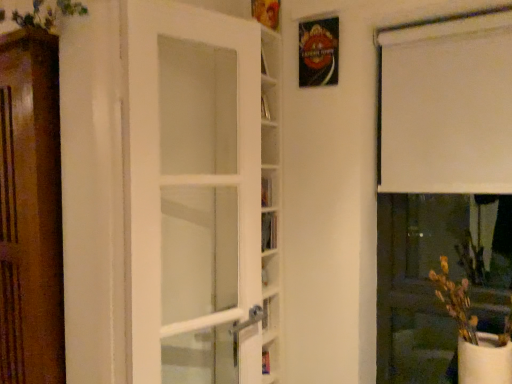
Question: From a real-world perspective, is white glass door at center positioned above or below hardcover book at center?

Choices:
 (A) below
 (B) above

Answer: (A)

Question: Is point (186, 14) positioned closer to the camera than point (270, 203)?

Choices:
 (A) closer
 (B) farther

Answer: (A)

Question: Based on their relative distances, which object is nearer to the white glass door at center?

Choices:
 (A) green leafy plant at upper left
 (B) white matte vase at lower right
 (C) metallic poster at upper center
 (D) hardcover book at center
 (E) white matte curtain at upper right

Answer: (D)

Question: Which of these objects is positioned closest to the hardcover book at center?

Choices:
 (A) white matte vase at lower right
 (B) white matte curtain at upper right
 (C) green leafy plant at upper left
 (D) white glass door at center
 (E) metallic poster at upper center

Answer: (D)